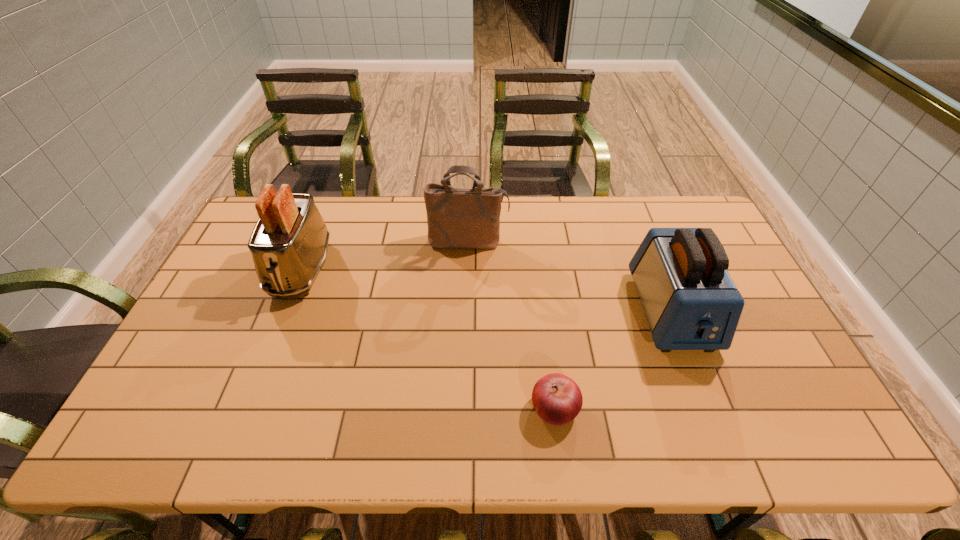
In order to click on toaster at the far edge in this screenshot , I will do `click(289, 243)`.

Identify the location of object situated at the near edge. (557, 399).

Find the location of `object at the left edge`. object at the left edge is located at coordinates (289, 243).

You are a GUI agent. You are given a task and a screenshot of the screen. Output one action in this format:
    pyautogui.click(x=<x>, y=<y>)
    Task: Click on the object at the right edge
    This screenshot has height=540, width=960.
    Given the screenshot: What is the action you would take?
    pyautogui.click(x=690, y=301)

Locate an element on the screen. The image size is (960, 540). object that is at the far left corner is located at coordinates (289, 243).

Locate an element on the screen. This screenshot has width=960, height=540. vacant region at the far edge of the desktop is located at coordinates (611, 224).

The width and height of the screenshot is (960, 540). I want to click on free space at the near edge of the desktop, so click(669, 416).

In the image, there is a desktop. At what (x,y) coordinates should I click in order to perform the action: click on blank space at the left edge. Please return your answer as a coordinate pair (x, y). Looking at the image, I should click on [223, 355].

Identify the location of free region at the right edge of the desktop. The image size is (960, 540). (759, 388).

This screenshot has width=960, height=540. I want to click on vacant region at the near left corner of the desktop, so click(x=155, y=424).